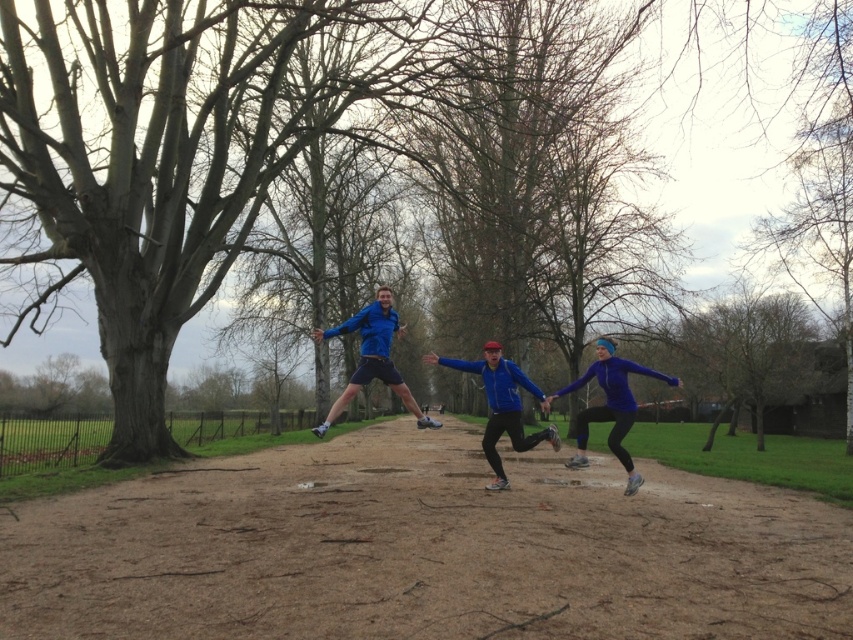
Question: Does brown bark tree at center have a larger size compared to blue fabric jacket at center?

Choices:
 (A) yes
 (B) no

Answer: (A)

Question: Considering the relative positions of blue fabric jacket at center and blue matte jacket at center in the image provided, where is blue fabric jacket at center located with respect to blue matte jacket at center?

Choices:
 (A) below
 (B) above

Answer: (A)

Question: Among these points, which one is farthest from the camera?

Choices:
 (A) (596, 353)
 (B) (192, 12)
 (C) (396, 470)
 (D) (495, 404)

Answer: (A)

Question: Is brown bark tree at center positioned at the back of matte blue jacket at lower right?

Choices:
 (A) no
 (B) yes

Answer: (B)

Question: Which of the following is the farthest from the observer?

Choices:
 (A) matte blue jacket at lower right
 (B) brown dirt path at center
 (C) blue matte jacket at center
 (D) blue fabric jacket at center

Answer: (A)

Question: Which is farther from the blue matte jacket at center?

Choices:
 (A) blue fabric jacket at center
 (B) brown bark tree at center
 (C) matte blue jacket at lower right
 (D) brown dirt path at center

Answer: (B)